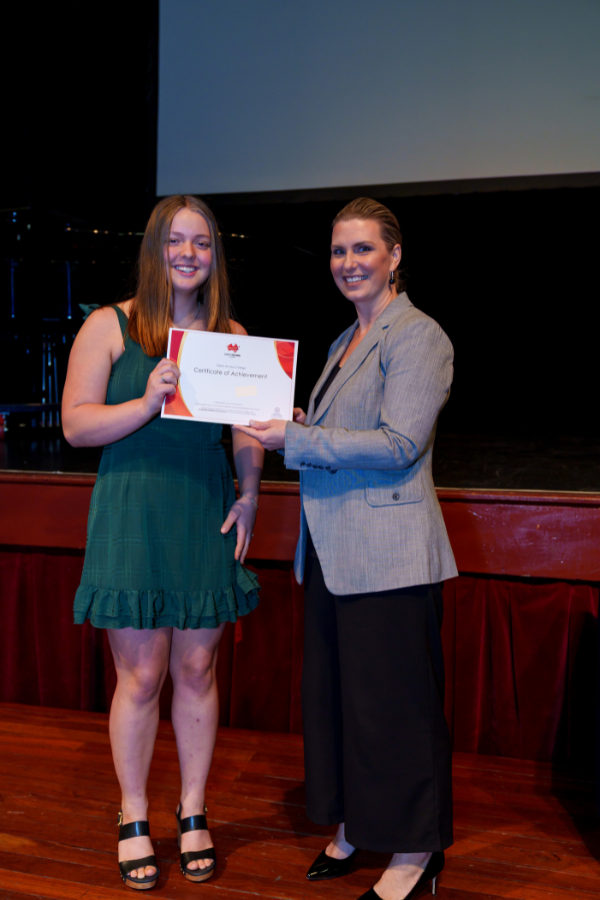
The image size is (600, 900). In order to click on screen in this screenshot , I will do 271,121.